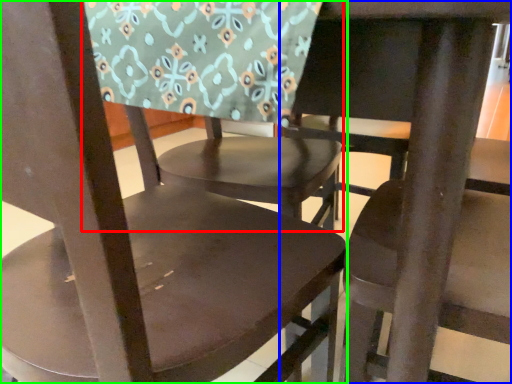
Question: Considering the real-world distances, which object is farthest from chair (highlighted by a red box)? chair (highlighted by a blue box) or chair (highlighted by a green box)?

Choices:
 (A) chair
 (B) chair

Answer: (A)